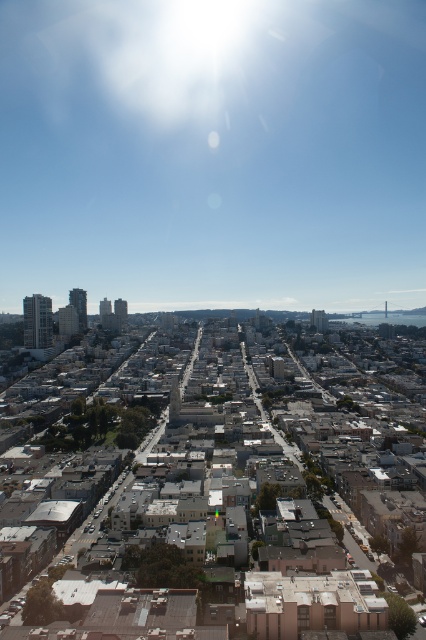
Which is above, bright white sunlight at upper center or gray concrete buildings at center?

Positioned higher is bright white sunlight at upper center.

Which is below, bright white sunlight at upper center or gray concrete buildings at center?

Positioned lower is gray concrete buildings at center.

The height and width of the screenshot is (640, 426). What do you see at coordinates (213, 150) in the screenshot? I see `bright white sunlight at upper center` at bounding box center [213, 150].

Identify the location of bright white sunlight at upper center. (213, 150).